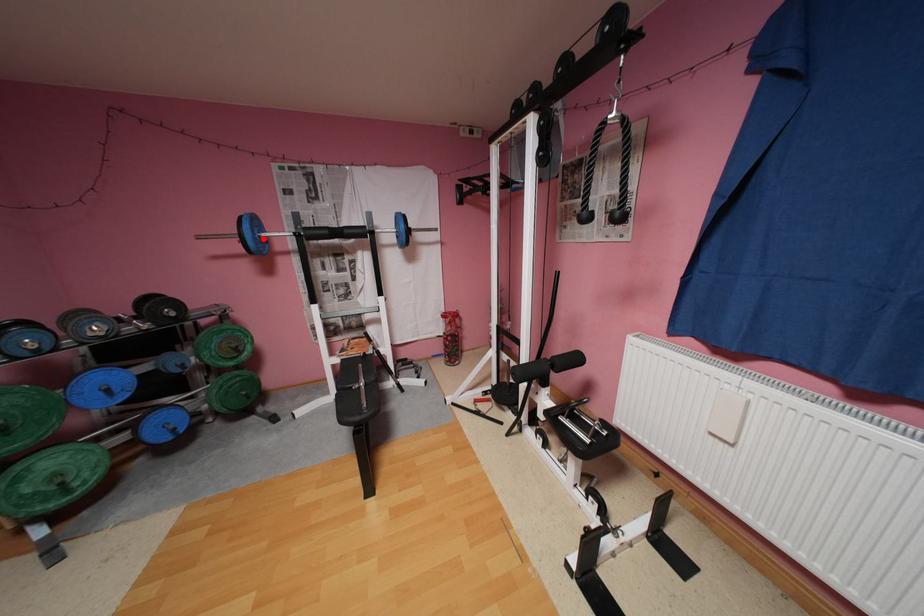
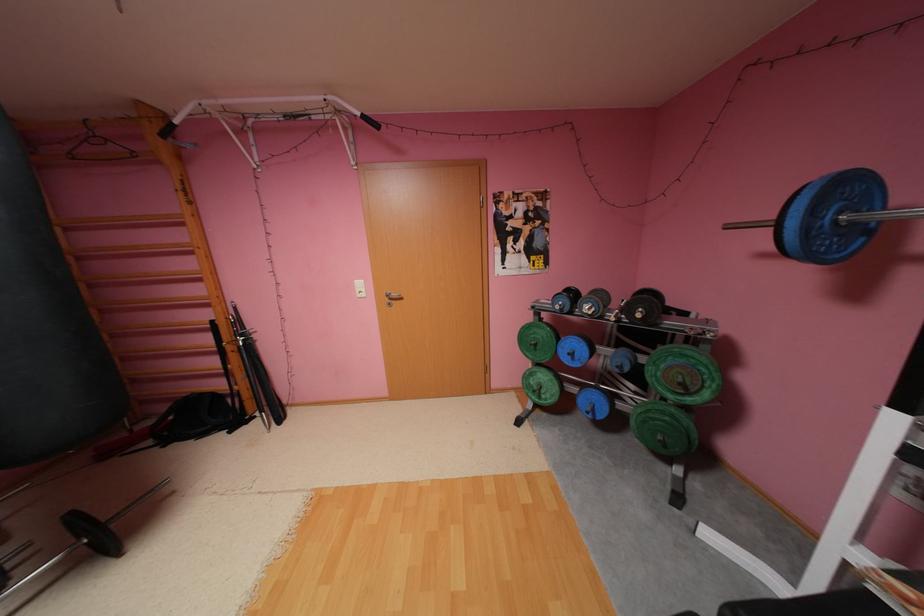
Where in the second image is the point corresponding to the highlighted location from the first image?

(816, 229)